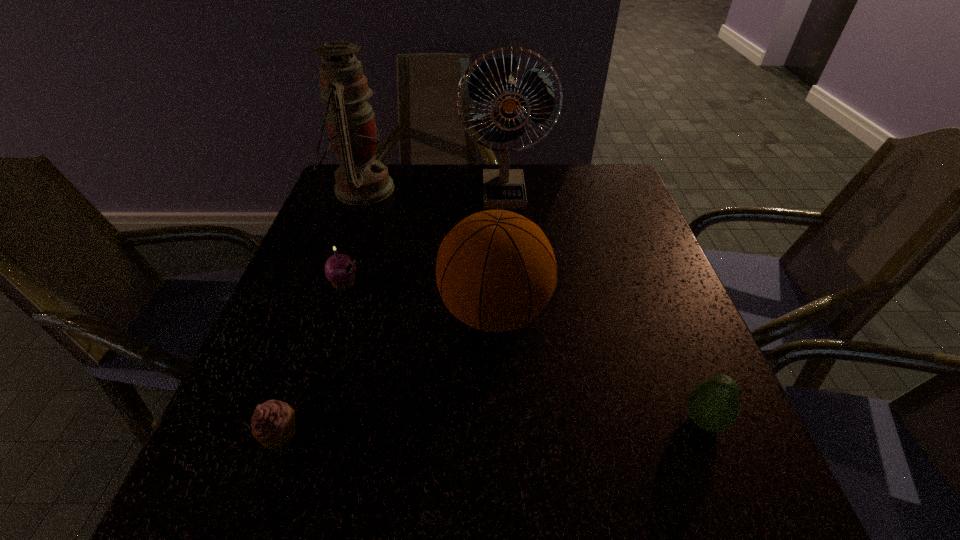
Find the location of a particular element. This screenshot has height=540, width=960. free spot between the fan and the avocado is located at coordinates (604, 307).

Identify the location of vacant space that's between the third tallest object and the rightmost object. (599, 366).

Locate an element on the screen. Image resolution: width=960 pixels, height=540 pixels. vacant point located between the avocado and the nearer cupcake is located at coordinates (492, 427).

The width and height of the screenshot is (960, 540). Find the location of `object that stands as the third closest to the oil lamp`. object that stands as the third closest to the oil lamp is located at coordinates (496, 270).

At what (x,y) coordinates should I click in order to perform the action: click on object that can be found as the third closest to the oil lamp. Please return your answer as a coordinate pair (x, y). This screenshot has width=960, height=540. Looking at the image, I should click on (496, 270).

Locate an element on the screen. blank area in the image that satisfies the following two spatial constraints: 1. on the face of the rightmost object; 2. on the left side of the taller cupcake is located at coordinates (300, 421).

This screenshot has width=960, height=540. In order to click on vacant area that satisfies the following two spatial constraints: 1. on the front-facing side of the fan; 2. on the face of the taller cupcake in this screenshot , I will do `click(511, 283)`.

Where is `free location that satisfies the following two spatial constraints: 1. on the back side of the basketball; 2. on the face of the farther cupcake`? free location that satisfies the following two spatial constraints: 1. on the back side of the basketball; 2. on the face of the farther cupcake is located at coordinates (493, 283).

Where is `vacant point that satisfies the following two spatial constraints: 1. on the face of the rightmost object; 2. on the left side of the taller cupcake`? vacant point that satisfies the following two spatial constraints: 1. on the face of the rightmost object; 2. on the left side of the taller cupcake is located at coordinates coord(300,421).

The image size is (960, 540). I want to click on vacant region that satisfies the following two spatial constraints: 1. on the face of the taller cupcake; 2. on the back side of the basketball, so click(335, 312).